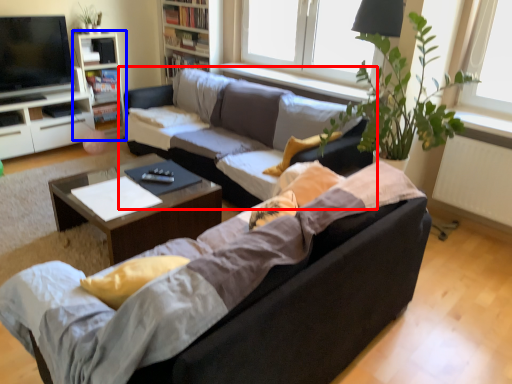
Question: Among these objects, which one is nearest to the camera, studio couch (highlighted by a red box) or bookshelf (highlighted by a blue box)?

Choices:
 (A) studio couch
 (B) bookshelf

Answer: (A)